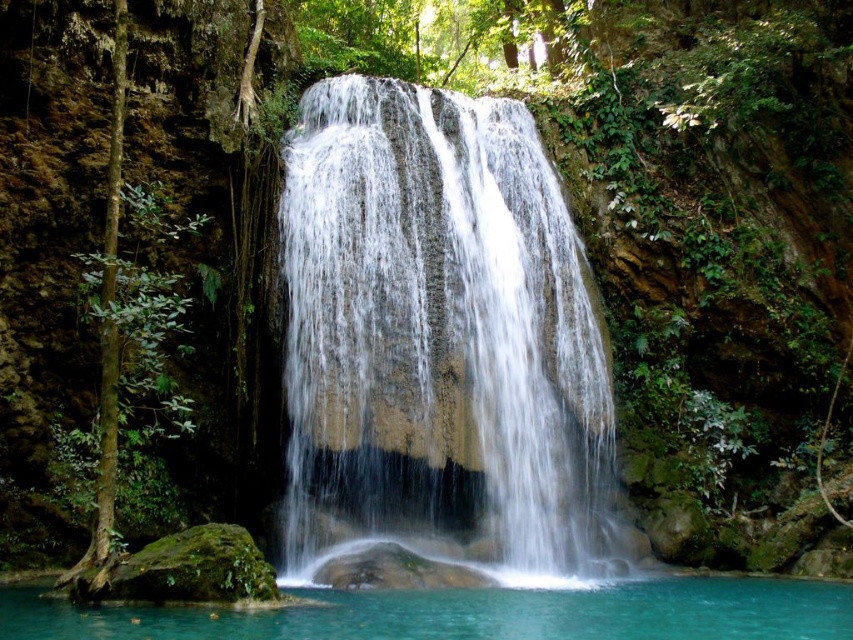
Question: Is white smooth waterfall at center below turquoise water at center?

Choices:
 (A) no
 (B) yes

Answer: (A)

Question: Is white smooth waterfall at center above turquoise water at center?

Choices:
 (A) no
 (B) yes

Answer: (B)

Question: Which object is farther from the camera taking this photo?

Choices:
 (A) turquoise water at center
 (B) white smooth waterfall at center

Answer: (B)

Question: Which object is farther from the camera taking this photo?

Choices:
 (A) turquoise water at center
 (B) white smooth waterfall at center

Answer: (B)

Question: Can you confirm if white smooth waterfall at center is positioned above turquoise water at center?

Choices:
 (A) no
 (B) yes

Answer: (B)